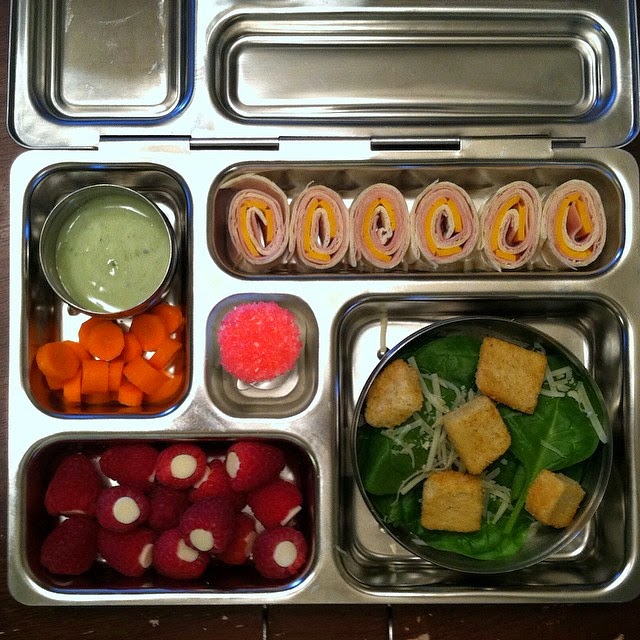
Image resolution: width=640 pixels, height=640 pixels. I want to click on bowl, so click(x=400, y=544), click(x=163, y=287).